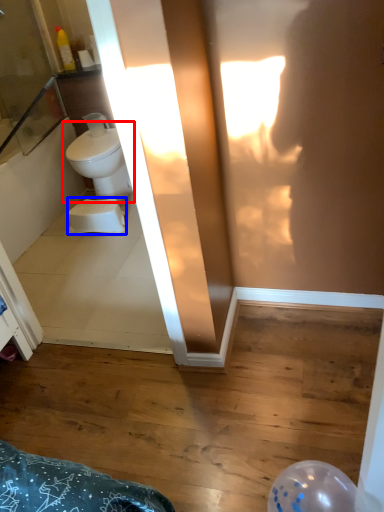
Question: Which point is further to the camera, toilet (highlighted by a red box) or toilet bowl (highlighted by a blue box)?

Choices:
 (A) toilet
 (B) toilet bowl

Answer: (A)